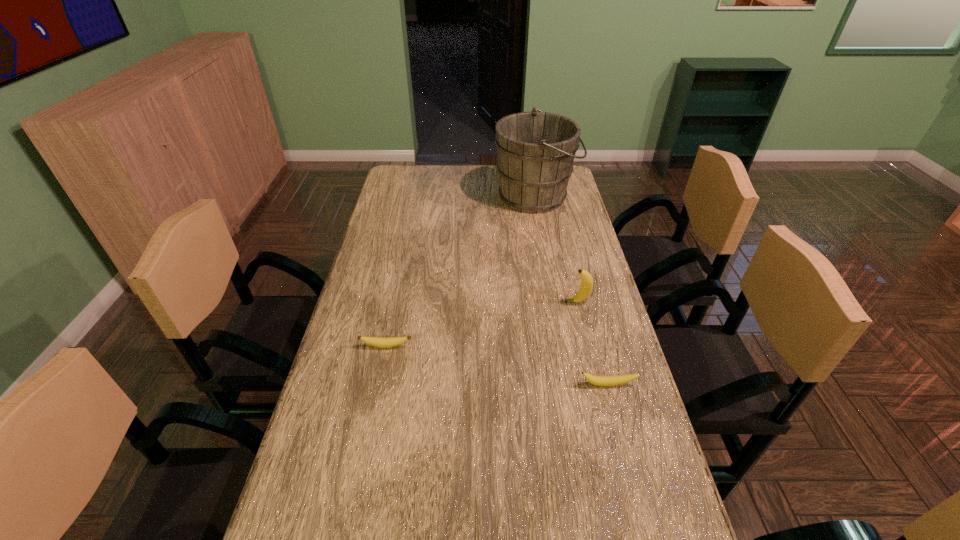
Identify the location of free location at the far left corner. (389, 191).

Where is `vacant area between the nearest banana and the leftmost object`? Image resolution: width=960 pixels, height=540 pixels. vacant area between the nearest banana and the leftmost object is located at coordinates (497, 365).

Where is `free spot between the second tallest object and the farthest object`? The height and width of the screenshot is (540, 960). free spot between the second tallest object and the farthest object is located at coordinates tap(556, 249).

I want to click on vacant space in between the tallest object and the second tallest object, so click(x=556, y=249).

Locate an element on the screen. The height and width of the screenshot is (540, 960). vacant region between the third tallest object and the farthest object is located at coordinates (571, 291).

Locate an element on the screen. The height and width of the screenshot is (540, 960). free area in between the farthest banana and the leftmost object is located at coordinates (482, 324).

This screenshot has height=540, width=960. I want to click on empty space between the third shortest object and the third tallest object, so click(x=592, y=343).

This screenshot has height=540, width=960. I want to click on free space between the bucket and the second nearest banana, so click(x=461, y=271).

This screenshot has height=540, width=960. I want to click on empty space that is in between the second nearest banana and the third tallest object, so click(x=497, y=365).

Image resolution: width=960 pixels, height=540 pixels. I want to click on vacant space that is in between the second shortest object and the bucket, so click(571, 291).